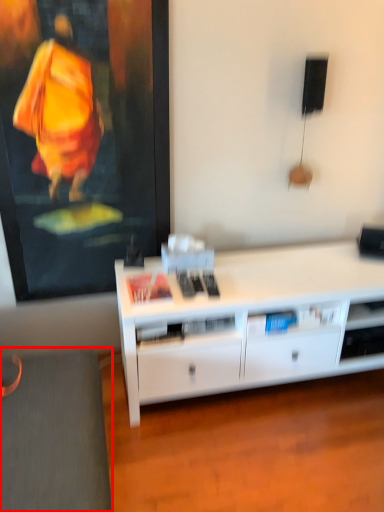
Question: In this image, where is gray (annotated by the red box) located relative to desk?

Choices:
 (A) right
 (B) left

Answer: (B)